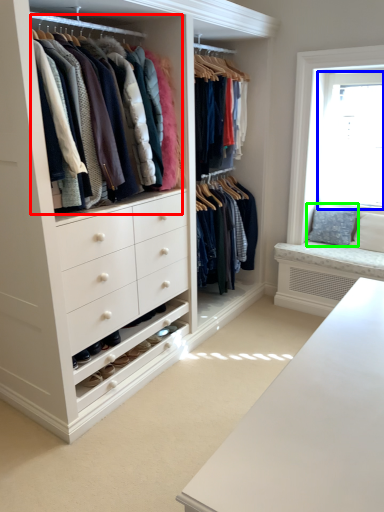
Question: Estimate the real-world distances between objects in this image. Which object is closer to closet (highlighted by a red box), bay window (highlighted by a blue box) or pillow (highlighted by a green box)?

Choices:
 (A) bay window
 (B) pillow

Answer: (A)